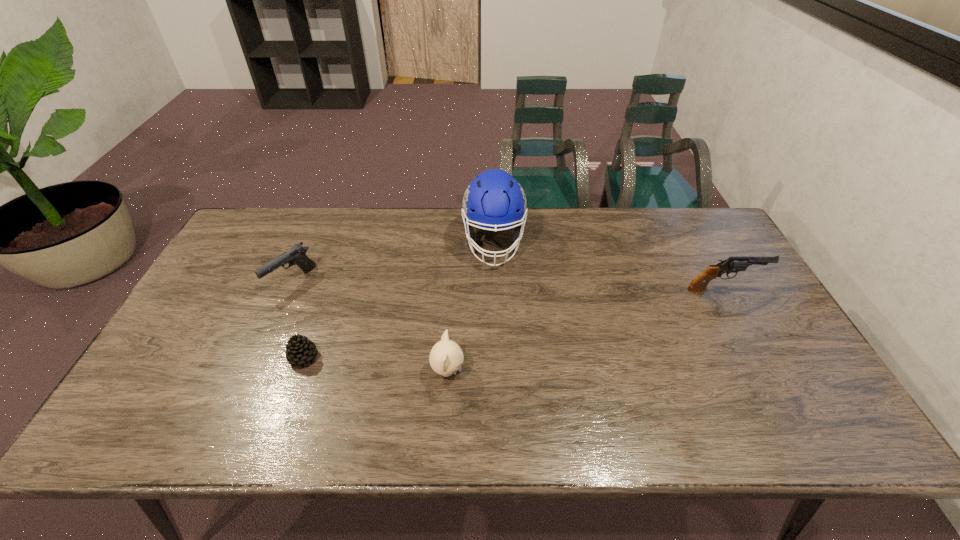
Identify the location of the tallest object. (494, 199).

The image size is (960, 540). I want to click on the rightmost object, so click(734, 264).

The height and width of the screenshot is (540, 960). I want to click on the fourth shortest object, so pos(734,264).

At what (x,y) coordinates should I click in order to perform the action: click on the leftmost object. Please return your answer as a coordinate pair (x, y). The image size is (960, 540). Looking at the image, I should click on (296, 255).

Identify the location of the left gun. (296, 255).

The width and height of the screenshot is (960, 540). I want to click on kitten, so click(446, 357).

Where is `the shortest object`? The image size is (960, 540). the shortest object is located at coordinates (300, 351).

Locate an element on the screen. the fourth object from right to left is located at coordinates (300, 351).

In order to click on free space located 0.050m on the face guard of the football helmet in this screenshot , I will do `click(495, 284)`.

The image size is (960, 540). Identify the location of vacant space located 0.190m at the muzzle of the left gun. (261, 353).